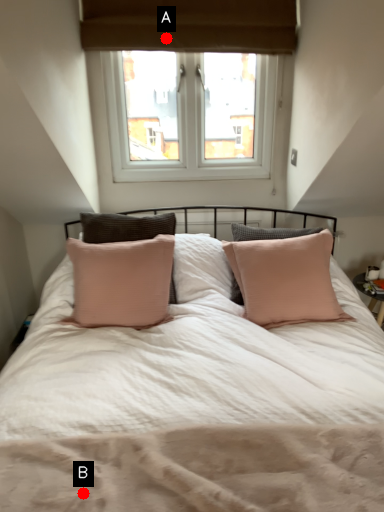
Question: Two points are circled on the image, labeled by A and B beside each circle. Which point appears farthest from the camera in this image?

Choices:
 (A) A is further
 (B) B is further

Answer: (A)